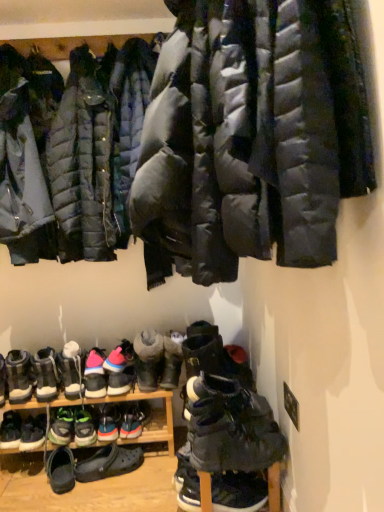
Question: Is matte black puffer jacket at upper left, the second jacket positioned from the back, inside dark gray suede boots at lower center, positioned as the first footwear in right-to-left order?

Choices:
 (A) yes
 (B) no

Answer: (B)

Question: Is dark gray suede boots at lower center, arranged as the fifteenth footwear when viewed from the left, taller than matte black puffer jacket at upper left, acting as the 2th jacket starting from the front?

Choices:
 (A) no
 (B) yes

Answer: (A)

Question: Can you confirm if dark gray suede boots at lower center, positioned as the first footwear in right-to-left order, is smaller than matte black puffer jacket at upper left, acting as the 2th jacket starting from the front?

Choices:
 (A) yes
 (B) no

Answer: (A)

Question: From the image's perspective, is dark gray suede boots at lower center, positioned as the first footwear in right-to-left order, on matte black puffer jacket at upper left, the second jacket positioned from the back?

Choices:
 (A) yes
 (B) no

Answer: (B)

Question: Is dark gray suede boots at lower center, arranged as the fifteenth footwear when viewed from the left, behind matte black puffer jacket at upper left, the second jacket positioned from the back?

Choices:
 (A) no
 (B) yes

Answer: (A)

Question: Is gray suede boot at center, the 11th footwear viewed from the left, wider or thinner than multicolored suede booties at center, placed as the 9th footwear when sorted from left to right?

Choices:
 (A) wide
 (B) thin

Answer: (B)

Question: Is point (152, 380) closer or farther from the camera than point (115, 348)?

Choices:
 (A) farther
 (B) closer

Answer: (B)

Question: From their relative heights in the image, would you say gray suede boot at center, which ranks as the fifth footwear in right-to-left order, is taller or shorter than multicolored suede booties at center, which appears as the seventh footwear when viewed from the right?

Choices:
 (A) short
 (B) tall

Answer: (B)

Question: Choose the correct answer: Is gray suede boot at center, which ranks as the fifth footwear in right-to-left order, inside multicolored suede booties at center, which appears as the seventh footwear when viewed from the right, or outside it?

Choices:
 (A) inside
 (B) outside

Answer: (B)

Question: Is multicolored fabric sneaker at center, the sixth footwear when ordered from right to left, spatially inside dark gray suede boots at lower center, arranged as the fifteenth footwear when viewed from the left, or outside of it?

Choices:
 (A) inside
 (B) outside

Answer: (B)

Question: Is point (132, 404) positioned closer to the camera than point (210, 470)?

Choices:
 (A) farther
 (B) closer

Answer: (A)

Question: Is multicolored fabric sneaker at center, the sixth footwear when ordered from right to left, wider or thinner than dark gray suede boots at lower center, arranged as the fifteenth footwear when viewed from the left?

Choices:
 (A) thin
 (B) wide

Answer: (A)

Question: In terms of size, does multicolored fabric sneaker at center, the tenth footwear when ordered from left to right, appear bigger or smaller than dark gray suede boots at lower center, positioned as the first footwear in right-to-left order?

Choices:
 (A) small
 (B) big

Answer: (A)

Question: Is green suede sneakers at lower left, which ranks as the third footwear in left-to-right order, situated inside gray suede boot at center, which ranks as the fifth footwear in right-to-left order, or outside?

Choices:
 (A) outside
 (B) inside

Answer: (A)

Question: From the image's perspective, is green suede sneakers at lower left, which is the thirteenth footwear in right-to-left order, located above or below gray suede boot at center, which ranks as the fifth footwear in right-to-left order?

Choices:
 (A) below
 (B) above

Answer: (A)